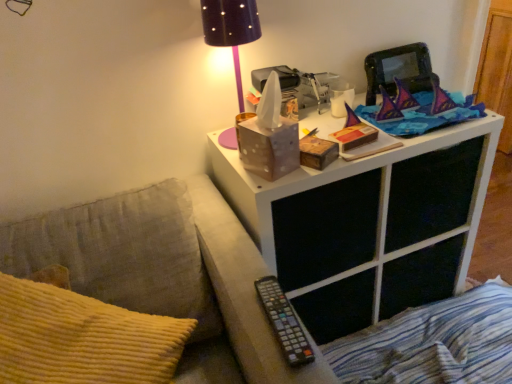
What do you see at coordinates (82, 338) in the screenshot? The height and width of the screenshot is (384, 512). I see `yellow corduroy pillow at lower left` at bounding box center [82, 338].

What is the approximate height of white matte side table at upper right?

white matte side table at upper right is 29.03 inches in height.

Where is `white matte side table at upper right`? The image size is (512, 384). white matte side table at upper right is located at coordinates (166, 271).

Where is `white matte nightstand at upper right`? Image resolution: width=512 pixels, height=384 pixels. white matte nightstand at upper right is located at coordinates (368, 225).

Locate an element on the screen. black dotted fabric lampshade at upper center is located at coordinates (231, 30).

Describe the element at coordinates (284, 322) in the screenshot. The width and height of the screenshot is (512, 384). I see `black plastic remote at lower center` at that location.

What are the coordinates of `yellow corduroy pillow at lower left` in the screenshot? It's located at (82, 338).

Are black dotted fabric lampshade at upper center and white matte side table at upper right making contact?

No.

Does black dotted fabric lampshade at upper center lie in front of white matte side table at upper right?

No, black dotted fabric lampshade at upper center is further to the viewer.

Could you tell me if black dotted fabric lampshade at upper center is turned towards white matte side table at upper right?

No, black dotted fabric lampshade at upper center is not aimed at white matte side table at upper right.

How many degrees apart are the facing directions of black dotted fabric lampshade at upper center and white matte side table at upper right?

There is a 0.00183-degree angle between the facing directions of black dotted fabric lampshade at upper center and white matte side table at upper right.

Can you confirm if blue striped fabric at lower right is bigger than white matte nightstand at upper right?

Incorrect, blue striped fabric at lower right is not larger than white matte nightstand at upper right.

Between blue striped fabric at lower right and white matte nightstand at upper right, which one has more height?

Standing taller between the two is white matte nightstand at upper right.

From the image's perspective, does blue striped fabric at lower right appear higher than white matte nightstand at upper right?

Incorrect, from the image's perspective, blue striped fabric at lower right is lower than white matte nightstand at upper right.

Is blue striped fabric at lower right far from white matte nightstand at upper right?

No, blue striped fabric at lower right is in close proximity to white matte nightstand at upper right.

Is black dotted fabric lampshade at upper center in front of white matte nightstand at upper right?

Yes, the depth of black dotted fabric lampshade at upper center is less than that of white matte nightstand at upper right.

Is black dotted fabric lampshade at upper center at the right side of white matte nightstand at upper right?

No, black dotted fabric lampshade at upper center is not to the right of white matte nightstand at upper right.

Is black dotted fabric lampshade at upper center positioned with its back to white matte nightstand at upper right?

black dotted fabric lampshade at upper center does not have its back to white matte nightstand at upper right.

Is black dotted fabric lampshade at upper center completely or partially inside white matte nightstand at upper right?

No, white matte nightstand at upper right does not contain black dotted fabric lampshade at upper center.

The height and width of the screenshot is (384, 512). What are the coordinates of `table lamp above the white matte nightstand at upper right (from a real-world perspective)` in the screenshot? It's located at (231, 30).

Considering the sizes of objects white matte nightstand at upper right and black dotted fabric lampshade at upper center in the image provided, who is bigger, white matte nightstand at upper right or black dotted fabric lampshade at upper center?

With larger size is white matte nightstand at upper right.

Is white matte nightstand at upper right at the right side of black dotted fabric lampshade at upper center?

Yes.

From a real-world perspective, is black plastic remote at lower center physically below yellow corduroy pillow at lower left?

Actually, black plastic remote at lower center is physically above yellow corduroy pillow at lower left in the real world.

Which object is more forward, black plastic remote at lower center or yellow corduroy pillow at lower left?

yellow corduroy pillow at lower left is more forward.

In the scene shown: Can you confirm if black plastic remote at lower center is thinner than yellow corduroy pillow at lower left?

No.

Which is more to the left, black plastic remote at lower center or yellow corduroy pillow at lower left?

From the viewer's perspective, yellow corduroy pillow at lower left appears more on the left side.

Is black dotted fabric lampshade at upper center not within black plastic remote at lower center?

That's correct, black dotted fabric lampshade at upper center is outside of black plastic remote at lower center.

From the image's perspective, between black dotted fabric lampshade at upper center and black plastic remote at lower center, who is located below?

From the image's view, black plastic remote at lower center is below.

Which is in front, black dotted fabric lampshade at upper center or black plastic remote at lower center?

Positioned in front is black plastic remote at lower center.

Is point (231, 31) positioned behind point (282, 302)?

Yes, point (231, 31) is farther from viewer.

In order to click on furniture on the left of white matte nightstand at upper right in this screenshot , I will do `click(166, 271)`.

Is white matte side table at upper right surrounded by white matte nightstand at upper right?

No, white matte side table at upper right is located outside of white matte nightstand at upper right.

Which is more to the right, white matte nightstand at upper right or white matte side table at upper right?

Positioned to the right is white matte nightstand at upper right.

Could you tell me if white matte nightstand at upper right is turned towards white matte side table at upper right?

No, white matte nightstand at upper right is not turned towards white matte side table at upper right.

Where is `furniture below the black dotted fabric lampshade at upper center (from a real-world perspective)`? furniture below the black dotted fabric lampshade at upper center (from a real-world perspective) is located at coordinates (166, 271).

Find the location of a particular element. The image size is (512, 384). nightstand above the blue striped fabric at lower right (from the image's perspective) is located at coordinates (368, 225).

Looking at the image, which one is located further to yellow corduroy pillow at lower left, white matte side table at upper right or black dotted fabric lampshade at upper center?

black dotted fabric lampshade at upper center.

Which object lies nearer to the anchor point white matte side table at upper right, yellow corduroy pillow at lower left or white matte nightstand at upper right?

yellow corduroy pillow at lower left lies closer to white matte side table at upper right than the other object.

Looking at the image, which one is located further to blue striped fabric at lower right, yellow corduroy pillow at lower left or white matte side table at upper right?

yellow corduroy pillow at lower left.

Which object lies further to the anchor point white matte side table at upper right, white matte nightstand at upper right or black dotted fabric lampshade at upper center?

→ black dotted fabric lampshade at upper center.

Estimate the real-world distances between objects in this image. Which object is closer to black dotted fabric lampshade at upper center, blue striped fabric at lower right or white matte nightstand at upper right?

The object closer to black dotted fabric lampshade at upper center is white matte nightstand at upper right.

When comparing their distances from white matte nightstand at upper right, does black dotted fabric lampshade at upper center or yellow corduroy pillow at lower left seem closer?

black dotted fabric lampshade at upper center.

From the image, which object appears to be farther from white matte nightstand at upper right, black dotted fabric lampshade at upper center or blue striped fabric at lower right?

black dotted fabric lampshade at upper center.

Which object lies further to the anchor point white matte side table at upper right, black dotted fabric lampshade at upper center or black plastic remote at lower center?

black dotted fabric lampshade at upper center lies further to white matte side table at upper right than the other object.

Where is `remote between yellow corduroy pillow at lower left and white matte nightstand at upper right in the horizontal direction`? This screenshot has width=512, height=384. remote between yellow corduroy pillow at lower left and white matte nightstand at upper right in the horizontal direction is located at coordinates (284, 322).

At what (x,y) coordinates should I click in order to perform the action: click on nightstand between yellow corduroy pillow at lower left and blue striped fabric at lower right from left to right. Please return your answer as a coordinate pair (x, y). The image size is (512, 384). Looking at the image, I should click on (368, 225).

Locate an element on the screen. nightstand between black dotted fabric lampshade at upper center and white matte side table at upper right in the up-down direction is located at coordinates (368, 225).

This screenshot has height=384, width=512. I want to click on furniture between yellow corduroy pillow at lower left and black plastic remote at lower center in the horizontal direction, so click(x=166, y=271).